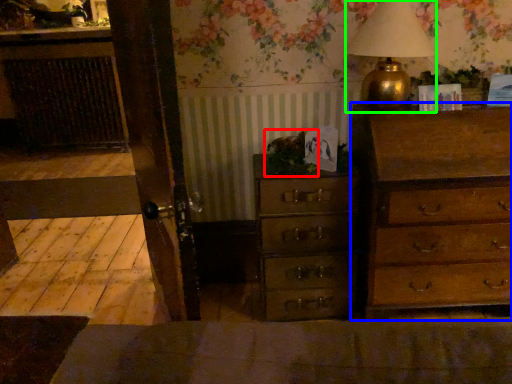
Question: Which object is the farthest from plant (highlighted by a red box)? Choose among these: chest of drawers (highlighted by a blue box) or table lamp (highlighted by a green box).

Choices:
 (A) chest of drawers
 (B) table lamp

Answer: (A)